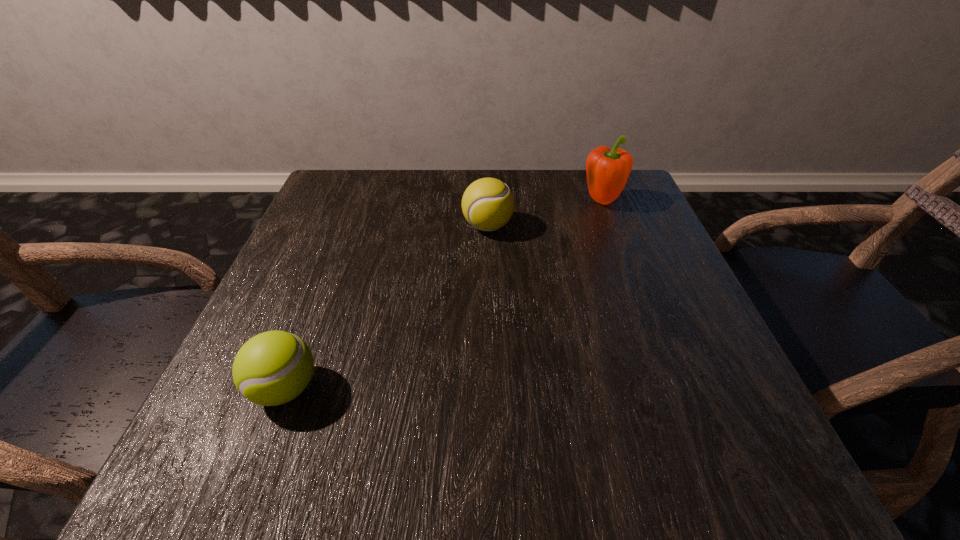
Locate an element on the screen. tennis ball positioned at the far edge is located at coordinates point(487,204).

Locate an element on the screen. object that is at the left edge is located at coordinates (272, 368).

The image size is (960, 540). Identify the location of object situated at the right edge. (607, 170).

Where is `object located at the far right corner`? Image resolution: width=960 pixels, height=540 pixels. object located at the far right corner is located at coordinates (607, 170).

The width and height of the screenshot is (960, 540). What are the coordinates of `free space at the far edge of the desktop` in the screenshot? It's located at (545, 170).

What are the coordinates of `free region at the near edge` in the screenshot? It's located at (403, 441).

I want to click on free space at the left edge of the desktop, so click(x=322, y=255).

Locate an element on the screen. Image resolution: width=960 pixels, height=540 pixels. free space at the right edge is located at coordinates coord(627,316).

At what (x,y) coordinates should I click in order to perform the action: click on free spot at the near left corner of the desktop. Please return your answer as a coordinate pair (x, y). This screenshot has width=960, height=540. Looking at the image, I should click on (257, 475).

The width and height of the screenshot is (960, 540). I want to click on free location at the far right corner of the desktop, so click(x=632, y=174).